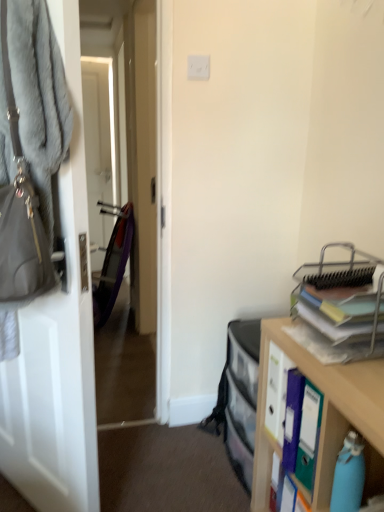
Question: Is wooden cabinet at right to the left or to the right of gray furry handbag at left in the image?

Choices:
 (A) right
 (B) left

Answer: (A)

Question: From the image's perspective, relative to gray furry handbag at left, is wooden cabinet at right above or below?

Choices:
 (A) above
 (B) below

Answer: (B)

Question: Which object is positioned closest to the gray fuzzy coat at left?

Choices:
 (A) white matte door at left
 (B) metallic silver organizer at right
 (C) gray furry handbag at left
 (D) wooden cabinet at right

Answer: (A)

Question: Considering the real-world distances, which object is farthest from the metallic silver organizer at right?

Choices:
 (A) wooden cabinet at right
 (B) gray fuzzy coat at left
 (C) white matte door at left
 (D) gray furry handbag at left

Answer: (B)